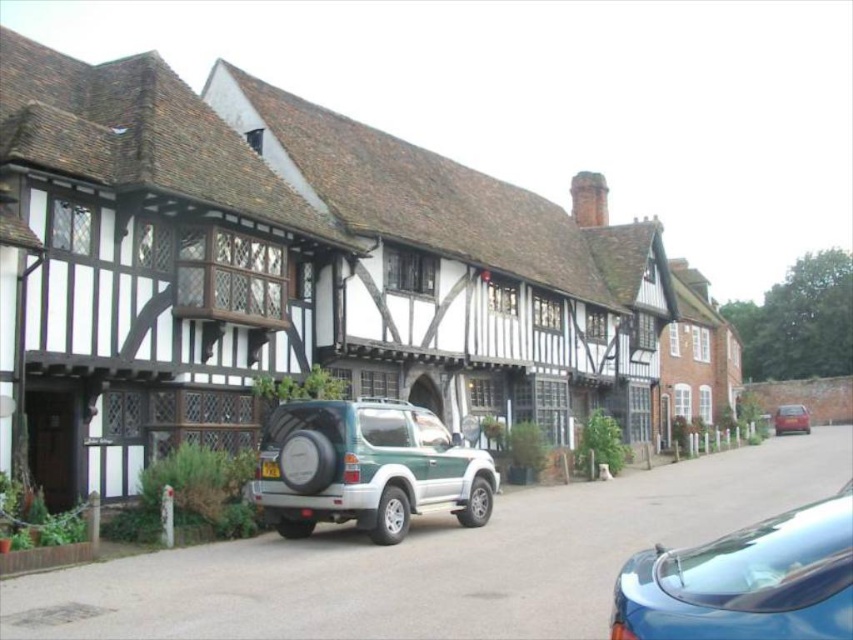
You are standing at the entrance of the street and want to park your car near the green matte suv at center. According to the coordinates provided, where exactly should you position your car?

The green matte suv at center is located at coordinates point (367, 467), so you should position your car near that point to park near it.

You are a pedestrian standing at the edge of the street. You see the green matte suv at center and the glossy blue car at lower right. Which vehicle is closer to you?

The green matte suv at center is closer to you because it is positioned further to the viewer than the glossy blue car at lower right.